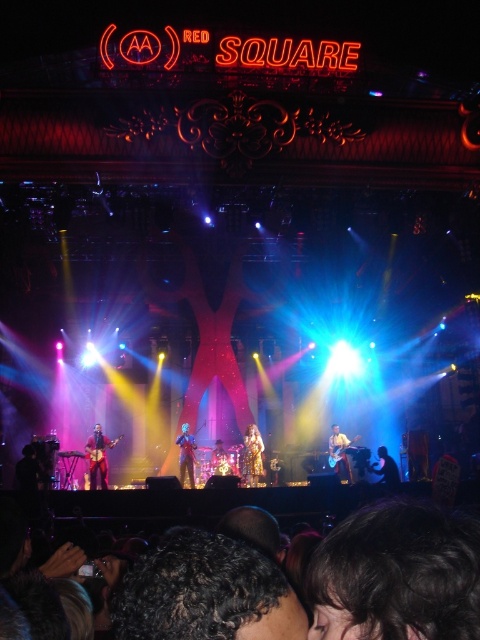
You are a photographer at the concert venue RED SQUARE. You need to capture a photo where the shiny blue suit at center and the matte black guitar at center are both visible. Based on their positions, which object should you focus on first to ensure both are in frame?

The shiny blue suit at center is located above the matte black guitar at center, so focusing on the shiny blue suit at center first will ensure both are in frame since it is positioned higher up.

You are a photographer at the concert venue. You need to capture a photo of the matte black guitar at lower left and the sparkly gold dress at center. If the guitar is wider than the dress, how should you frame the shot to ensure both are fully visible?

Since the matte black guitar at lower left is wider than the sparkly gold dress at center, you should position the camera to give more space to the guitar while still including the dress in the frame.

You are a photographer positioned at the back of the venue. You want to capture a clear photo of both the matte black guitar at lower left and the shiny blue suit at center. Given their sizes, which object should you focus on first to ensure it appears sharp in the photo?

The matte black guitar at lower left is much taller than the shiny blue suit at center, so you should focus on the matte black guitar at lower left first to ensure its full height is captured sharply.